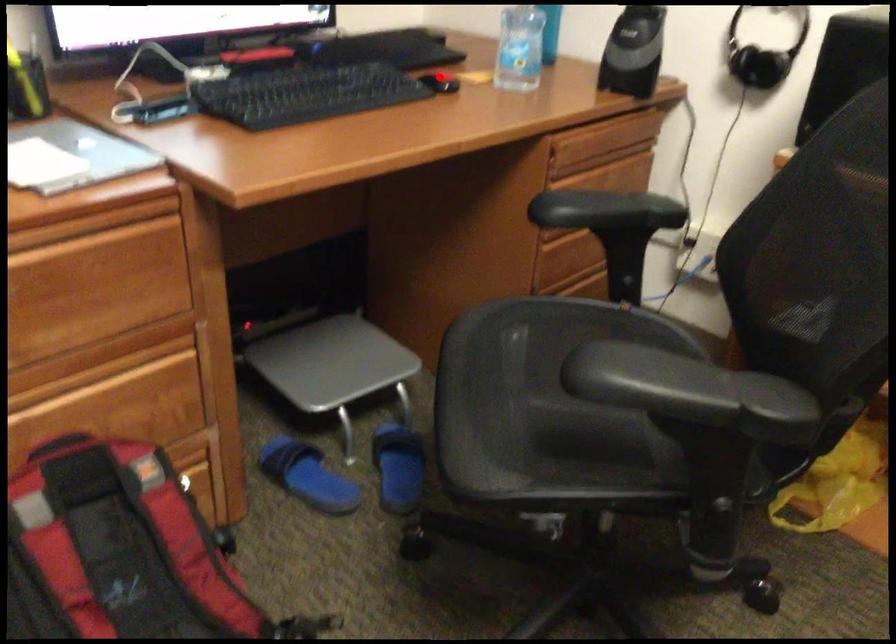
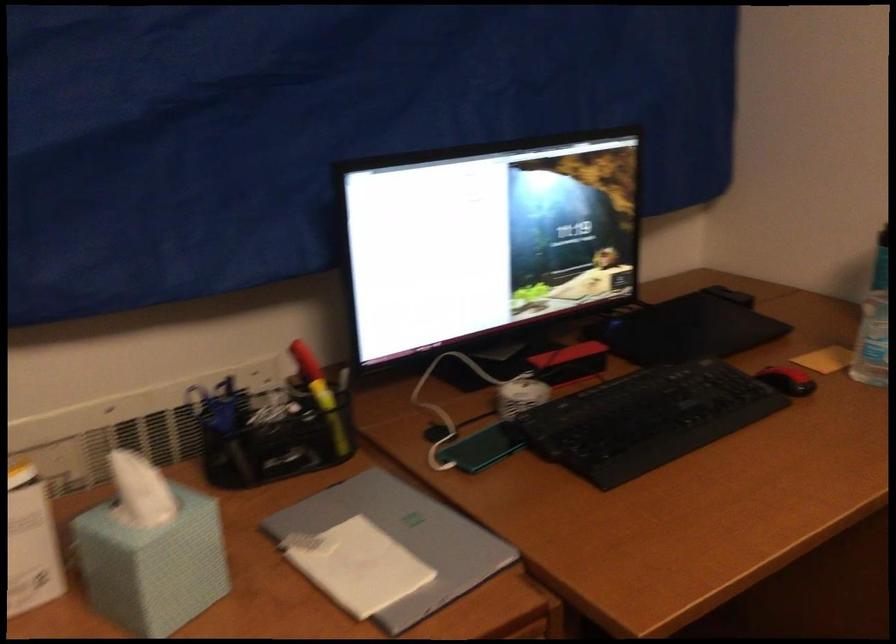
Question: I am providing you with two images of the same scene from different viewpoints. Image1 has a red point marked. In image2, the corresponding 3D location appears at what relative position? Reply with the corresponding letter.

Choices:
 (A) Closer
 (B) Farther

Answer: (A)